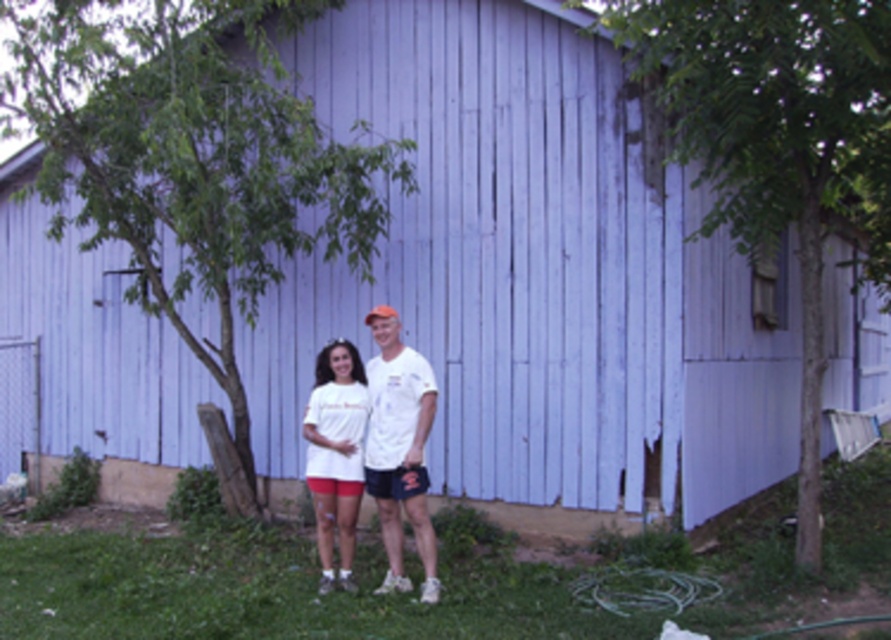
Question: Is white cotton t-shirt at center smaller than white matte t-shirt at center?

Choices:
 (A) yes
 (B) no

Answer: (B)

Question: Is white cotton t-shirt at center wider than white matte t-shirt at center?

Choices:
 (A) yes
 (B) no

Answer: (A)

Question: Which of the following is the farthest from the observer?

Choices:
 (A) white matte t-shirt at center
 (B) white cotton t-shirt at center

Answer: (A)

Question: In this image, where is white cotton t-shirt at center located relative to white matte t-shirt at center?

Choices:
 (A) right
 (B) left

Answer: (A)

Question: Which point appears closest to the camera in this image?

Choices:
 (A) [x=312, y=428]
 (B) [x=432, y=392]

Answer: (B)

Question: Which of the following is the closest to the observer?

Choices:
 (A) (405, 390)
 (B) (332, 356)

Answer: (A)